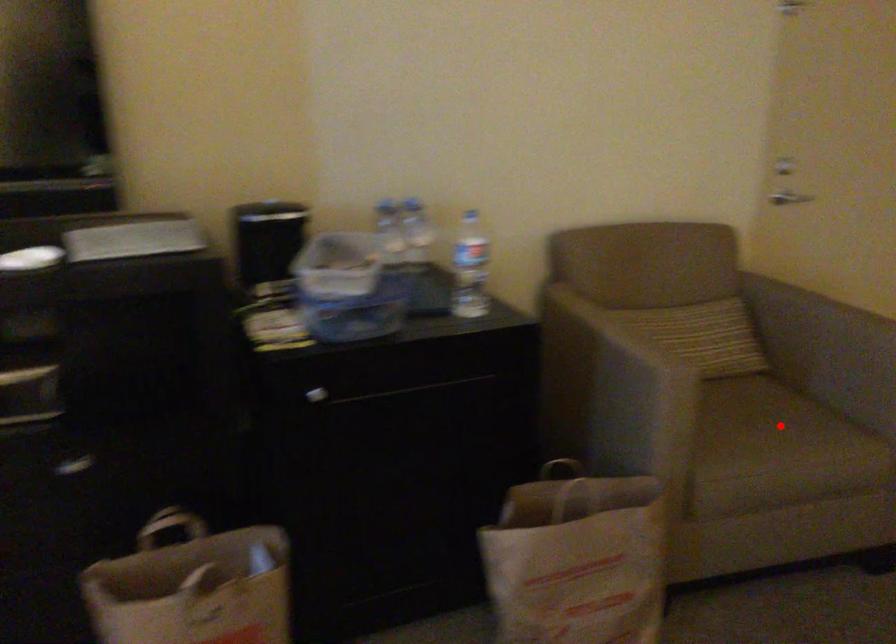
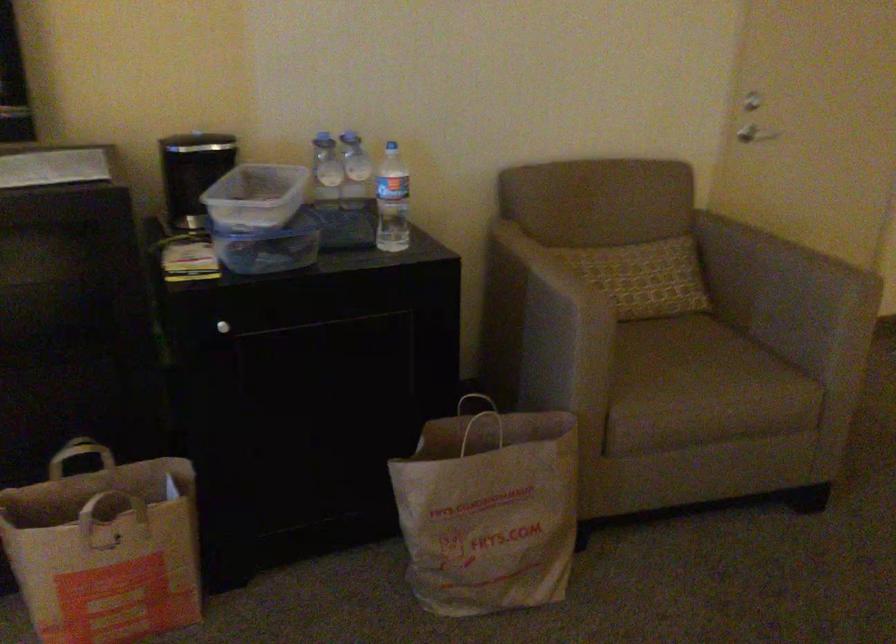
Question: I am providing you with two images of the same scene from different viewpoints. A red point is marked on the first image. Can you still see the location of the red point in image 2?

Choices:
 (A) Yes
 (B) No

Answer: (A)